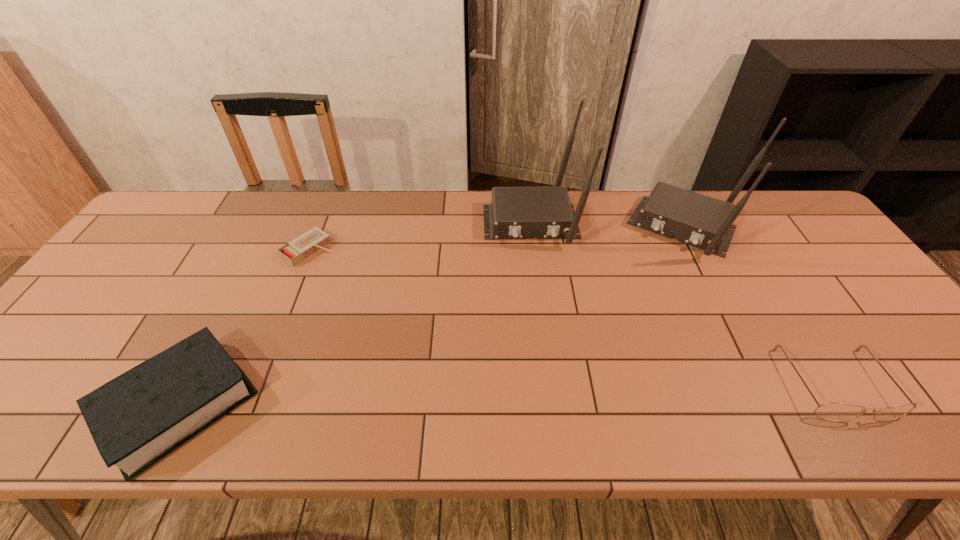
At what (x,y) coordinates should I click in order to perform the action: click on empty space that is in between the fourth tallest object and the third object from left to right. Please return your answer as a coordinate pair (x, y). This screenshot has width=960, height=540. Looking at the image, I should click on (684, 302).

Image resolution: width=960 pixels, height=540 pixels. What are the coordinates of `unoccupied area between the third tallest object and the shortest object` in the screenshot? It's located at (245, 327).

Identify the location of vacant space in between the left router and the right router. (609, 225).

This screenshot has width=960, height=540. I want to click on free space between the third object from right to left and the third tallest object, so click(354, 313).

Find the location of a particular element. Image resolution: width=960 pixels, height=540 pixels. vacant area that lies between the right router and the third object from left to right is located at coordinates click(609, 225).

Locate an element on the screen. The width and height of the screenshot is (960, 540). the third closest object to the third shortest object is located at coordinates (695, 219).

Find the location of `object that is the third closest one to the matchbox`. object that is the third closest one to the matchbox is located at coordinates (695, 219).